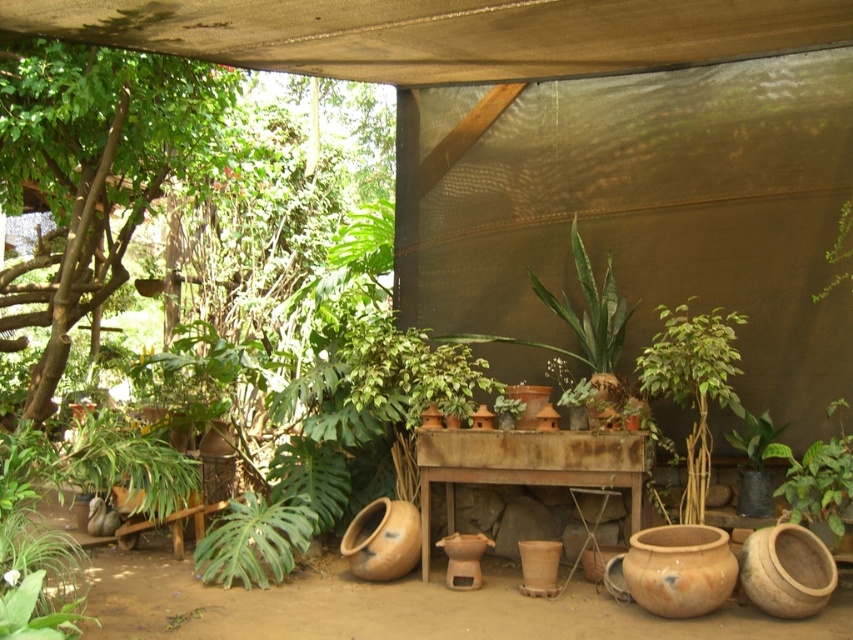
Does green leafy tree at left have a lesser width compared to rusty metal table at center?

No, green leafy tree at left is not thinner than rusty metal table at center.

Between green leafy tree at left and rusty metal table at center, which one has more height?

Standing taller between the two is green leafy tree at left.

Is point (100, 160) less distant than point (569, 481)?

Yes, point (100, 160) is in front of point (569, 481).

Locate an element on the screen. This screenshot has width=853, height=640. green leafy tree at left is located at coordinates (91, 170).